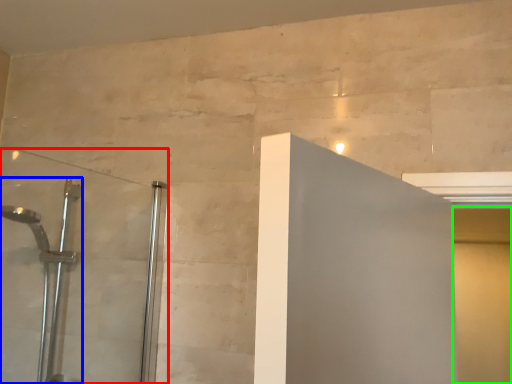
Question: Which object is positioned closest to shower door (highlighted by a red box)? Select from shower (highlighted by a blue box) and screen door (highlighted by a green box).

Choices:
 (A) shower
 (B) screen door

Answer: (A)